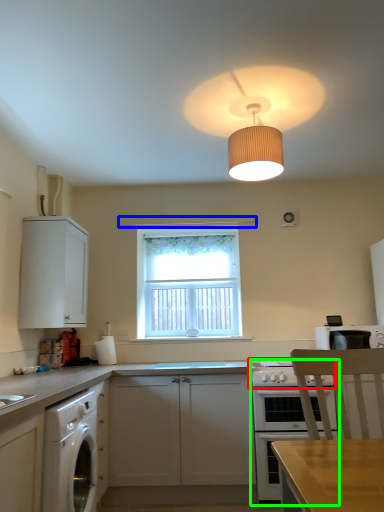
Question: Which is farther away from gas stove (highlighted by a red box)? exhaust hood (highlighted by a blue box) or oven (highlighted by a green box)?

Choices:
 (A) exhaust hood
 (B) oven

Answer: (A)